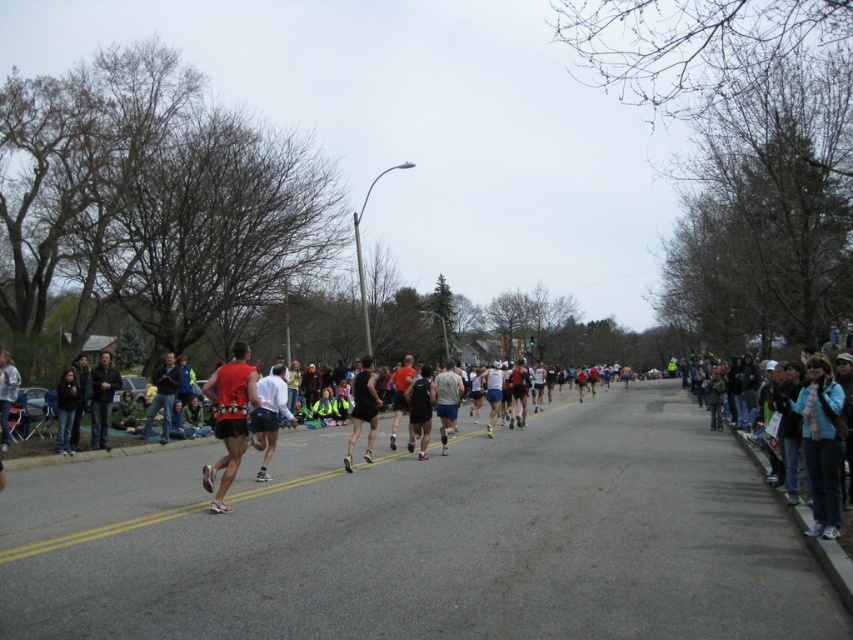
Does dark blue jeans at left have a larger size compared to black fabric backpack at center?

Yes.

Between point (170, 364) and point (422, 368), which one is positioned behind?

The point (170, 364) is more distant.

Identify the location of dark blue jeans at left. The height and width of the screenshot is (640, 853). (163, 396).

Who is lower down, matte red shorts at center or dark blue jeans at left?

dark blue jeans at left is lower down.

Can you confirm if matte red shorts at center is shorter than dark blue jeans at left?

Yes, matte red shorts at center is shorter than dark blue jeans at left.

Identify the location of matte red shorts at center. The width and height of the screenshot is (853, 640). (270, 416).

Does matte red tank top at center appear under matte black shorts at center?

Yes, matte red tank top at center is below matte black shorts at center.

What do you see at coordinates (229, 419) in the screenshot?
I see `matte red tank top at center` at bounding box center [229, 419].

The height and width of the screenshot is (640, 853). What do you see at coordinates (229, 419) in the screenshot?
I see `matte red tank top at center` at bounding box center [229, 419].

Identify the location of matte red tank top at center. (229, 419).